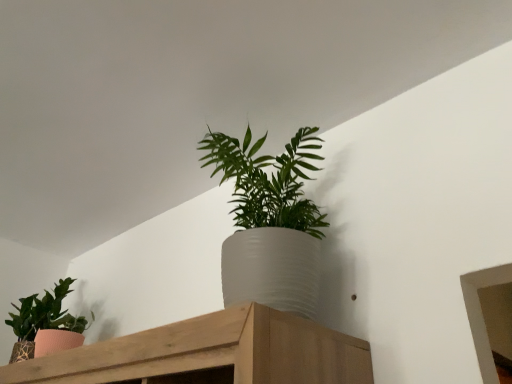
Question: From the image's perspective, relative to white textured pot at center, which ranks as the second houseplant in left-to-right order, is textured pink pot at left, the 1th houseplant viewed from the left, above or below?

Choices:
 (A) below
 (B) above

Answer: (A)

Question: Looking at the image, does textured pink pot at left, placed as the 2th houseplant when sorted from right to left, seem bigger or smaller compared to white textured pot at center, the first houseplant from the front?

Choices:
 (A) big
 (B) small

Answer: (B)

Question: From a real-world perspective, is textured pink pot at left, the second houseplant viewed from the front, above or below white textured pot at center, which is the first houseplant in right-to-left order?

Choices:
 (A) above
 (B) below

Answer: (B)

Question: Considering the positions of point (305, 162) and point (24, 347), is point (305, 162) closer or farther from the camera than point (24, 347)?

Choices:
 (A) farther
 (B) closer

Answer: (B)

Question: From a real-world perspective, is white textured pot at center, which is the first houseplant in right-to-left order, above or below textured pink pot at left, the 1th houseplant viewed from the left?

Choices:
 (A) below
 (B) above

Answer: (B)

Question: Considering the positions of white textured pot at center, the first houseplant from the front, and textured pink pot at left, placed as the 2th houseplant when sorted from right to left, in the image, is white textured pot at center, the first houseplant from the front, bigger or smaller than textured pink pot at left, placed as the 2th houseplant when sorted from right to left,?

Choices:
 (A) big
 (B) small

Answer: (A)

Question: Considering the positions of white textured pot at center, the first houseplant from the front, and textured pink pot at left, placed as the 1th houseplant when sorted from back to front, in the image, is white textured pot at center, the first houseplant from the front, wider or thinner than textured pink pot at left, placed as the 1th houseplant when sorted from back to front,?

Choices:
 (A) wide
 (B) thin

Answer: (A)